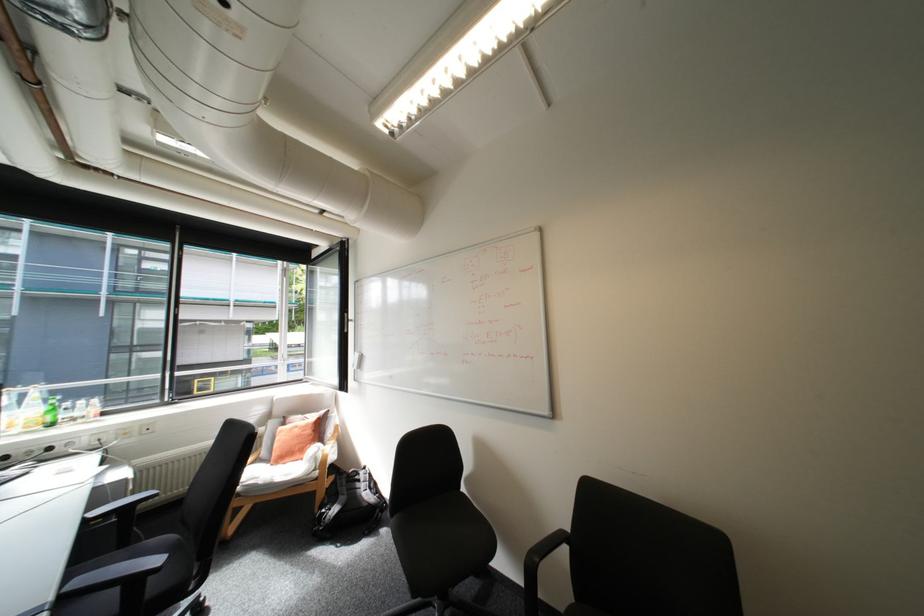
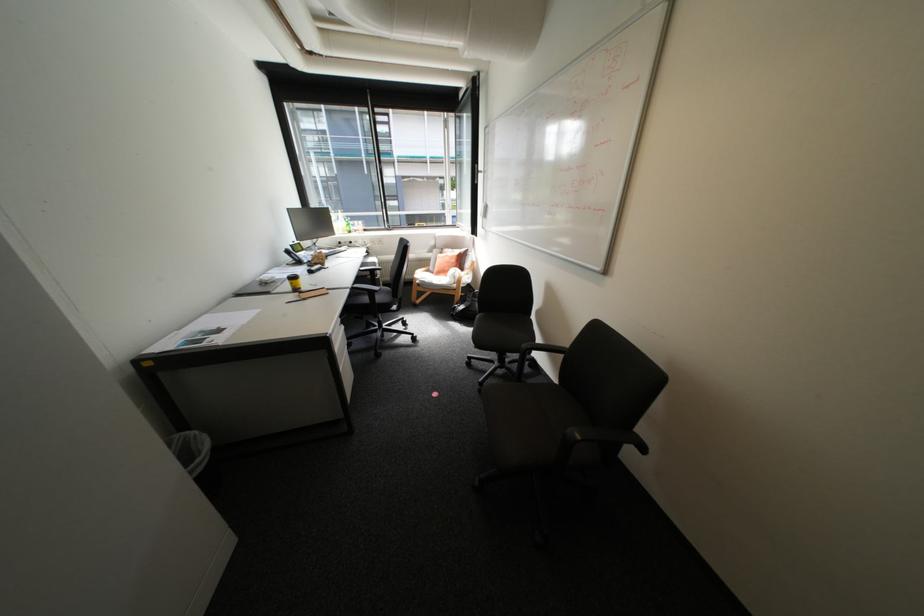
Where in the second image is the point corresponding to (310,416) from the first image?

(459, 249)